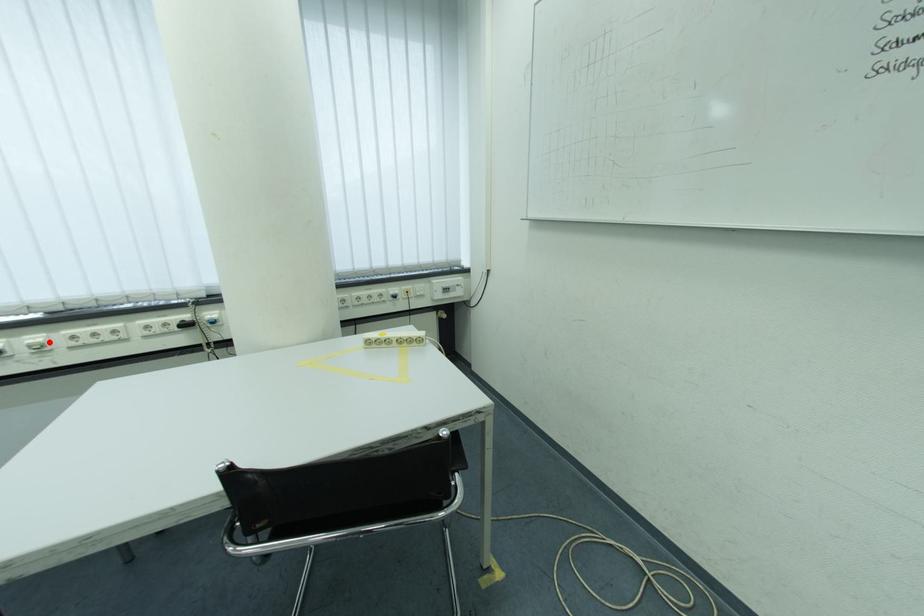
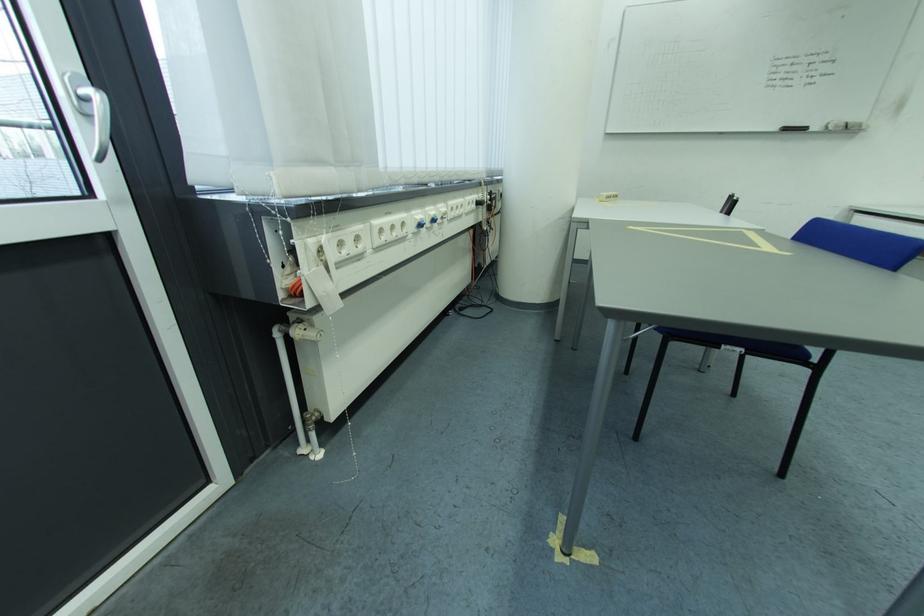
Question: I am providing you with two images of the same scene from different viewpoints. In image1, a red point is highlighted. Considering the same 3D point in image2, which of the following is correct?

Choices:
 (A) It is closer
 (B) It is farther

Answer: (A)